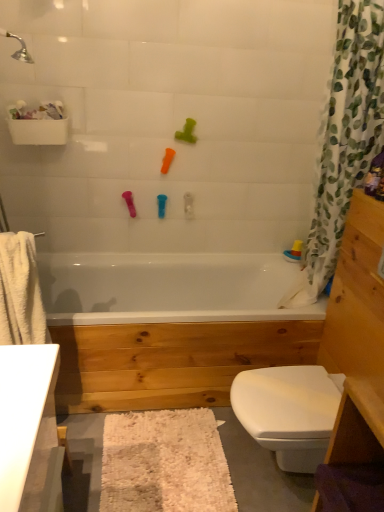
Question: Based on their sizes in the image, would you say translucent plastic boat at upper right, which appears as the 5th toy when viewed from the left, is bigger or smaller than white fabric shower curtain at right?

Choices:
 (A) small
 (B) big

Answer: (A)

Question: Considering the positions of point (291, 252) and point (357, 146), is point (291, 252) closer or farther from the camera than point (357, 146)?

Choices:
 (A) farther
 (B) closer

Answer: (A)

Question: Based on their relative distances, which object is farther from the white glossy bathtub at center?

Choices:
 (A) green rubber toy at upper center, the 5th toy ordered from the bottom
 (B) light brown wood vanity at right
 (C) rubber duck at center, the 5th toy positioned from the right
 (D) white fabric shower curtain at right
 (E) white shaggy bath mat at lower center

Answer: (A)

Question: Estimate the real-world distances between objects in this image. Which object is closer to the white shaggy bath mat at lower center?

Choices:
 (A) green rubber toy at upper center, the 5th toy ordered from the bottom
 (B) light brown wood vanity at right
 (C) translucent plastic boat at upper right, the first toy from the bottom
 (D) blue rubber toy at upper center, the 4th toy from the top
 (E) rubber duck at center, placed as the 3th toy when sorted from top to bottom

Answer: (B)